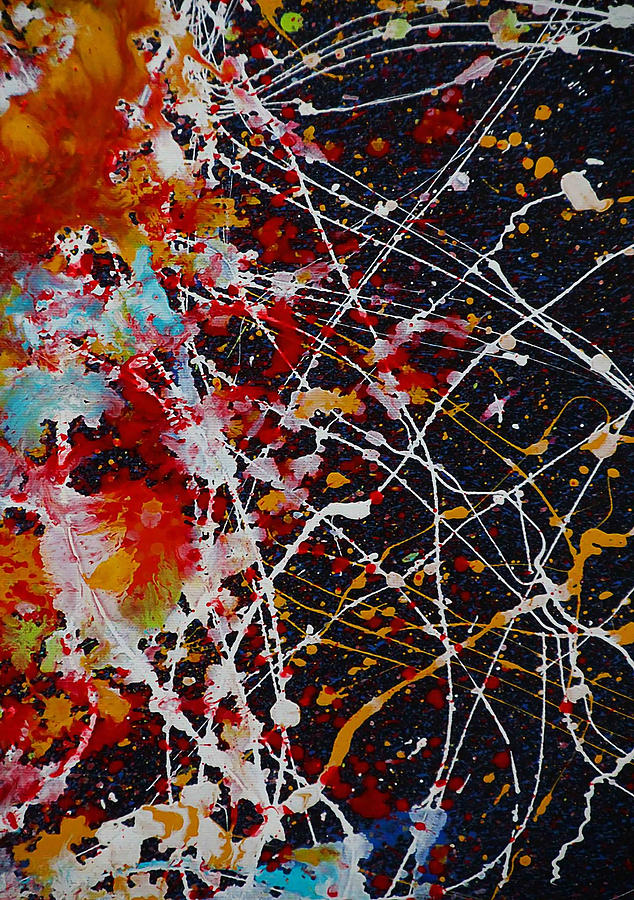
The width and height of the screenshot is (634, 900). Identify the location of painting. (413, 556).